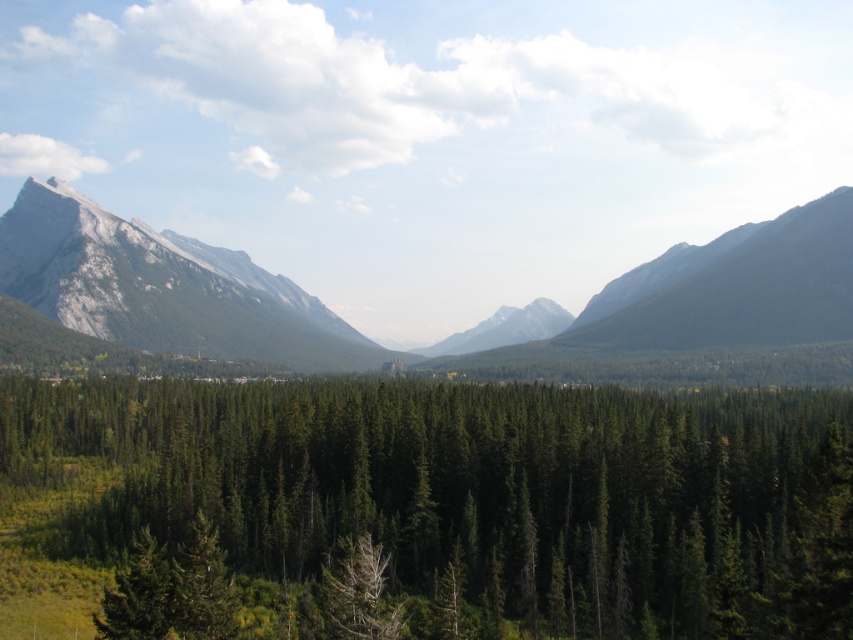
You are planning a hiking route and want to know if the dark gray rocky mountain at upper right is wider than the green matte tree at center. Can you confirm this based on the landscape?

The dark gray rocky mountain at upper right is wider than the green matte tree at center according to the description.